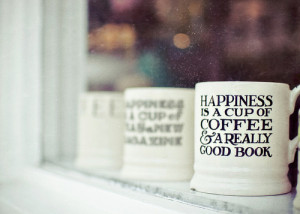
The height and width of the screenshot is (214, 300). Identify the location of mugs. (98, 146), (157, 132), (247, 145).